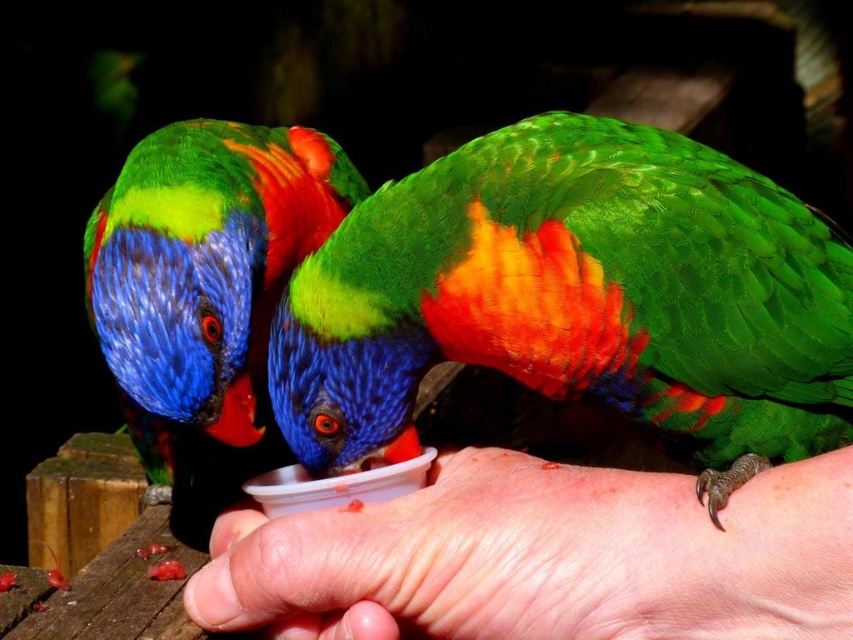
Question: Which point is closer to the camera taking this photo?

Choices:
 (A) click(x=744, y=516)
 (B) click(x=173, y=410)

Answer: (A)

Question: Which of the following is the farthest from the observer?

Choices:
 (A) shiny multicolored parrot at center
 (B) green glossy parrot at center
 (C) smooth skin hand at lower center

Answer: (A)

Question: Estimate the real-world distances between objects in this image. Which object is closer to the smooth skin hand at lower center?

Choices:
 (A) green glossy parrot at center
 (B) shiny multicolored parrot at center

Answer: (A)

Question: Is smooth skin hand at lower center to the right of shiny multicolored parrot at center from the viewer's perspective?

Choices:
 (A) yes
 (B) no

Answer: (A)

Question: Can you confirm if green glossy parrot at center is thinner than smooth skin hand at lower center?

Choices:
 (A) no
 (B) yes

Answer: (A)

Question: Can you confirm if smooth skin hand at lower center is positioned to the left of shiny multicolored parrot at center?

Choices:
 (A) no
 (B) yes

Answer: (A)